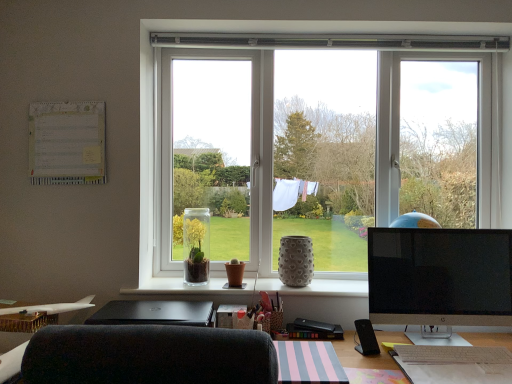
This screenshot has height=384, width=512. Identify the location of free space in front of clear glass vase at center, the 3th vase positioned from the right. (196, 285).